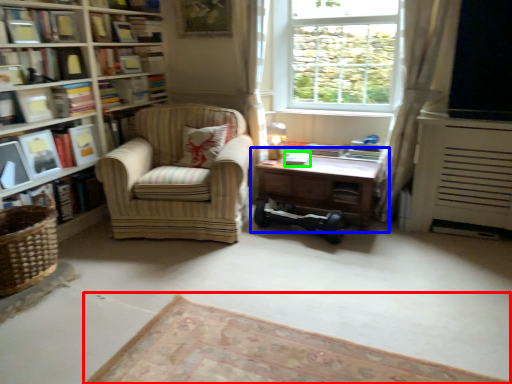
Question: Considering the real-world distances, which object is closest to plain (highlighted by a red box)? table (highlighted by a blue box) or paperback book (highlighted by a green box).

Choices:
 (A) table
 (B) paperback book

Answer: (A)